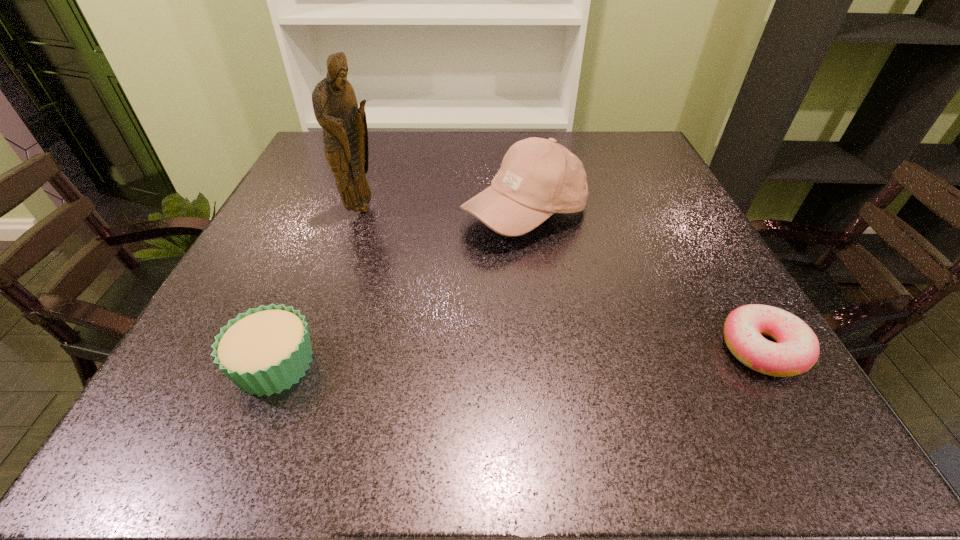
What are the coordinates of `vacant space located on the front-facing side of the tallest object` in the screenshot? It's located at (473, 310).

Find the location of a particular element. This screenshot has height=540, width=960. vacant region located on the front-facing side of the baseball cap is located at coordinates (566, 333).

Find the location of a particular element. vacant space located 0.160m on the front-facing side of the baseball cap is located at coordinates (559, 310).

This screenshot has width=960, height=540. I want to click on vacant area situated 0.200m on the front-facing side of the baseball cap, so click(x=564, y=328).

The image size is (960, 540). Identify the location of cupcake located in the near edge section of the desktop. (265, 350).

Locate an element on the screen. doughnut that is at the near edge is located at coordinates (797, 349).

Where is `cupcake at the left edge`? The height and width of the screenshot is (540, 960). cupcake at the left edge is located at coordinates (265, 350).

You are a GUI agent. You are given a task and a screenshot of the screen. Output one action in this format:
    pyautogui.click(x=<x>, y=<y>)
    Task: Click on the figurine that is at the left edge
    The image size is (960, 540).
    Given the screenshot: What is the action you would take?
    pyautogui.click(x=345, y=135)

The image size is (960, 540). I want to click on object that is at the right edge, so click(797, 349).

You are a GUI agent. You are given a task and a screenshot of the screen. Output one action in this format:
    pyautogui.click(x=<x>, y=<y>)
    Task: Click on the object located in the near left corner section of the desktop
    The image size is (960, 540).
    Given the screenshot: What is the action you would take?
    pyautogui.click(x=265, y=350)